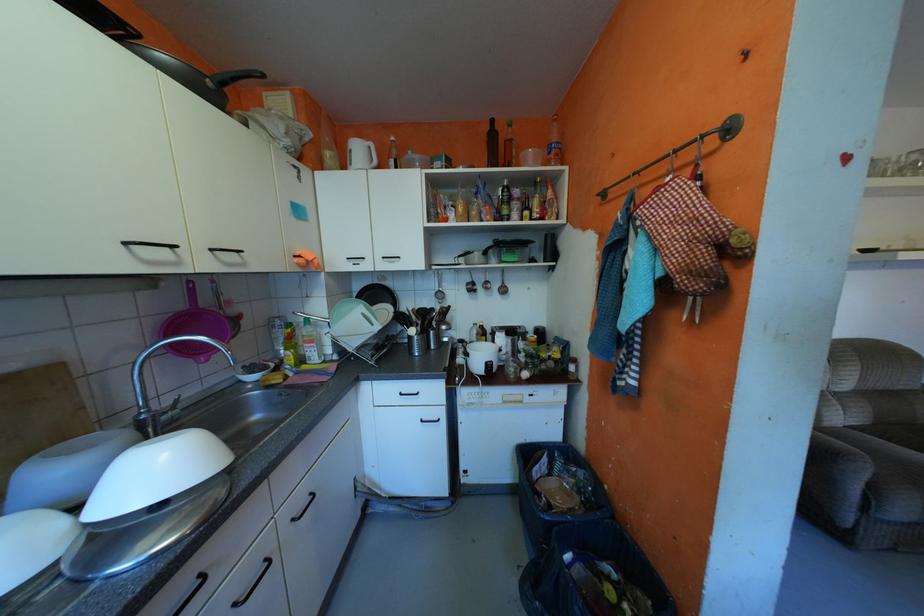
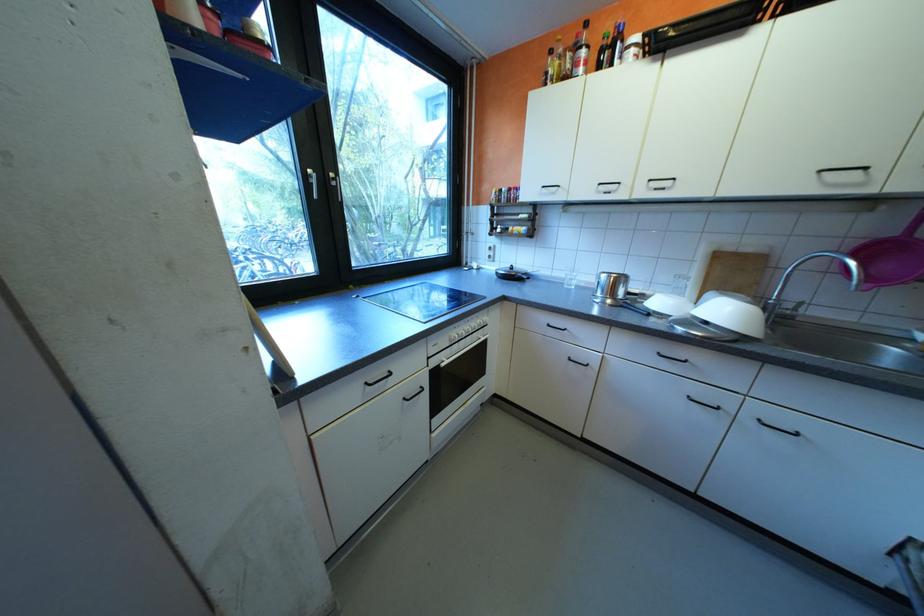
In the second image, find the point that corresponds to [190,304] in the first image.

(906, 231)